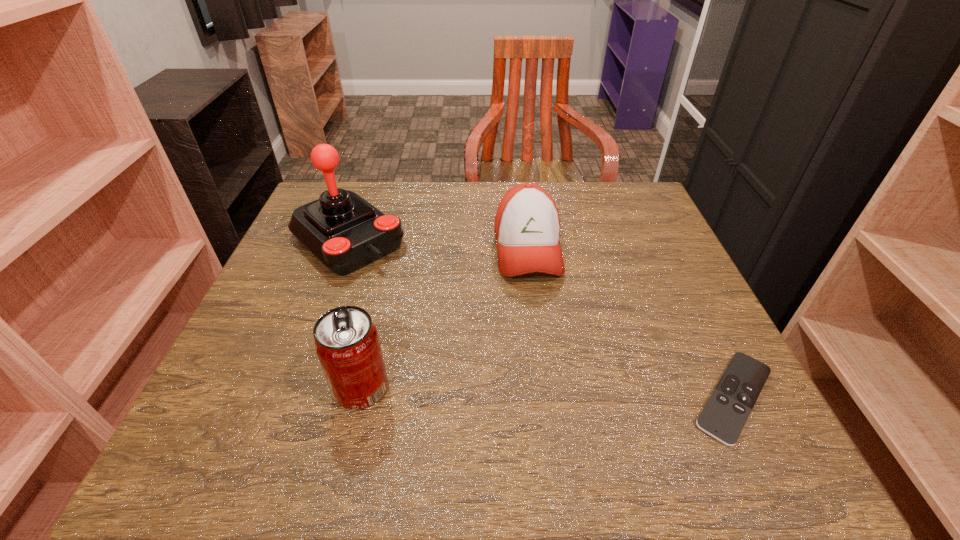
This screenshot has height=540, width=960. I want to click on empty location between the pop soda and the rightmost object, so click(x=547, y=393).

The height and width of the screenshot is (540, 960). Identify the location of free spot between the tallest object and the second object from right to left. (438, 244).

Find the location of a particular element. The height and width of the screenshot is (540, 960). blank region between the pop soda and the third tallest object is located at coordinates (x=444, y=318).

Identify the location of vacant space in between the tallest object and the shortest object. (540, 318).

Where is `vacant region between the tallest object and the third tallest object`? This screenshot has height=540, width=960. vacant region between the tallest object and the third tallest object is located at coordinates (438, 244).

You are a GUI agent. You are given a task and a screenshot of the screen. Output one action in this format:
    pyautogui.click(x=<x>, y=<y>)
    Task: Click on the free space between the rightmost object and the third tallest object
    
    Given the screenshot: What is the action you would take?
    pyautogui.click(x=631, y=323)

At what (x,y) coordinates should I click in order to perform the action: click on free area in between the second object from right to left and the shortest object. Please return your answer as a coordinate pair (x, y). Looking at the image, I should click on (631, 323).

The image size is (960, 540). Identify the location of the third closest object to the remote control. (345, 232).

What are the coordinates of `object that can be found as the third closest to the tallest object` in the screenshot? It's located at (723, 417).

This screenshot has height=540, width=960. Find the location of `free space in the image that satisfies the following two spatial constraints: 1. on the front side of the shortest object; 2. on the left side of the pop soda`. free space in the image that satisfies the following two spatial constraints: 1. on the front side of the shortest object; 2. on the left side of the pop soda is located at coordinates (359, 397).